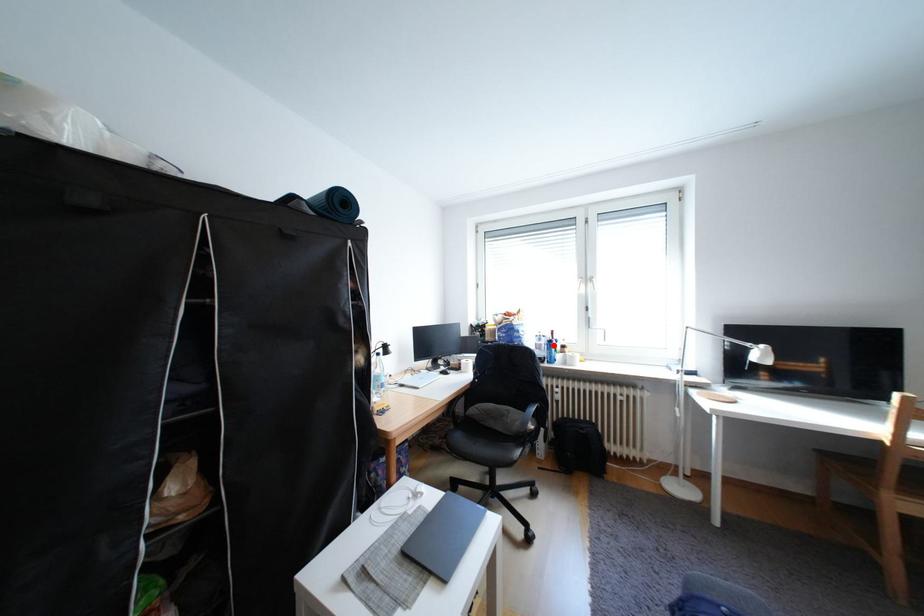
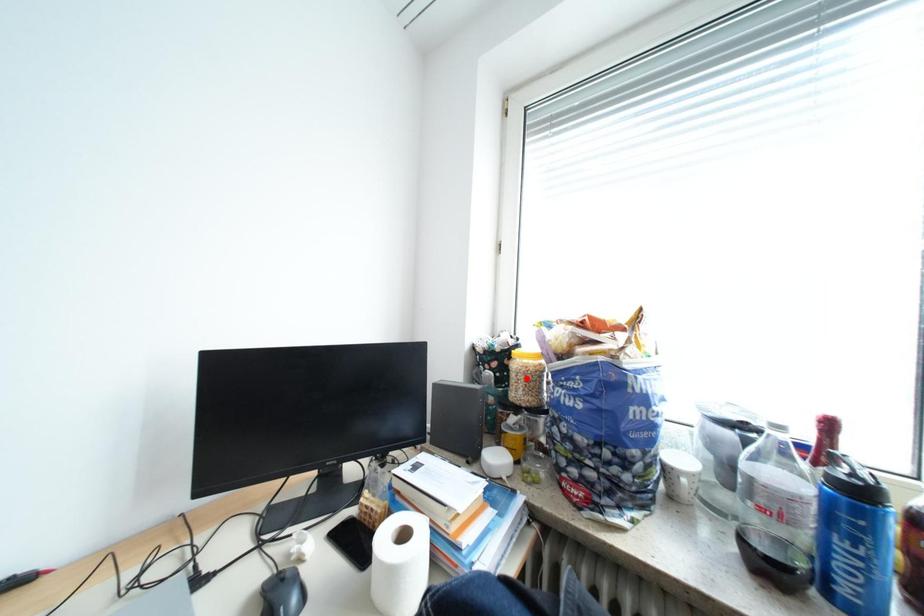
I am providing you with two images of the same scene from different viewpoints. A red point is marked on the first image and another point is marked on the second image. Is the red point in image1 aligned with the point shown in image2?

No